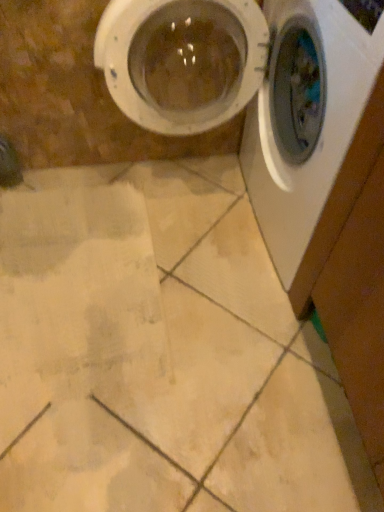
The height and width of the screenshot is (512, 384). What do you see at coordinates (254, 92) in the screenshot? I see `white plastic washing machine at upper right, the 2th washing machine when ordered from right to left` at bounding box center [254, 92].

Where is `white plastic washing machine at upper right, the 2th washing machine when ordered from right to left`? This screenshot has width=384, height=512. white plastic washing machine at upper right, the 2th washing machine when ordered from right to left is located at coordinates (254, 92).

How much space does white plastic washing machine at upper right, which ranks as the first washing machine in left-to-right order, occupy vertically?

white plastic washing machine at upper right, which ranks as the first washing machine in left-to-right order, is 32.14 inches tall.

Describe the element at coordinates (313, 131) in the screenshot. The height and width of the screenshot is (512, 384). I see `white glossy washing machine at right, which ranks as the 2th washing machine in left-to-right order` at that location.

Find the location of a particular element. The height and width of the screenshot is (512, 384). white glossy washing machine at right, which ranks as the 2th washing machine in left-to-right order is located at coordinates (313, 131).

What is the approximate width of white glossy washing machine at right, which is the first washing machine from right to left?

white glossy washing machine at right, which is the first washing machine from right to left, is 17.48 inches in width.

The image size is (384, 512). I want to click on white plastic washing machine at upper right, the 2th washing machine when ordered from right to left, so point(254,92).

Considering the positions of objects white glossy washing machine at right, which is the first washing machine from right to left, and white plastic washing machine at upper right, which ranks as the first washing machine in left-to-right order, in the image provided, who is more to the left, white glossy washing machine at right, which is the first washing machine from right to left, or white plastic washing machine at upper right, which ranks as the first washing machine in left-to-right order,?

white plastic washing machine at upper right, which ranks as the first washing machine in left-to-right order, is more to the left.

Relative to white plastic washing machine at upper right, the 2th washing machine when ordered from right to left, is white glossy washing machine at right, which is the first washing machine from right to left, in front or behind?

white glossy washing machine at right, which is the first washing machine from right to left, is positioned closer to the viewer than white plastic washing machine at upper right, the 2th washing machine when ordered from right to left.

Is point (279, 10) positioned before point (251, 154)?

That is True.

From the image's perspective, is white glossy washing machine at right, which ranks as the 2th washing machine in left-to-right order, on white plastic washing machine at upper right, which ranks as the first washing machine in left-to-right order?

No.

From a real-world perspective, which is physically below, white glossy washing machine at right, which is the first washing machine from right to left, or white plastic washing machine at upper right, which ranks as the first washing machine in left-to-right order?

white glossy washing machine at right, which is the first washing machine from right to left.

Considering the sizes of objects white glossy washing machine at right, which ranks as the 2th washing machine in left-to-right order, and white plastic washing machine at upper right, which ranks as the first washing machine in left-to-right order, in the image provided, who is wider, white glossy washing machine at right, which ranks as the 2th washing machine in left-to-right order, or white plastic washing machine at upper right, which ranks as the first washing machine in left-to-right order,?

Wider between the two is white plastic washing machine at upper right, which ranks as the first washing machine in left-to-right order.

Considering the sizes of objects white glossy washing machine at right, which is the first washing machine from right to left, and white plastic washing machine at upper right, which ranks as the first washing machine in left-to-right order, in the image provided, who is taller, white glossy washing machine at right, which is the first washing machine from right to left, or white plastic washing machine at upper right, which ranks as the first washing machine in left-to-right order,?

white plastic washing machine at upper right, which ranks as the first washing machine in left-to-right order.

Is white glossy washing machine at right, which ranks as the 2th washing machine in left-to-right order, bigger than white plastic washing machine at upper right, which ranks as the first washing machine in left-to-right order?

Yes, white glossy washing machine at right, which ranks as the 2th washing machine in left-to-right order, is bigger than white plastic washing machine at upper right, which ranks as the first washing machine in left-to-right order.

Is white glossy washing machine at right, which ranks as the 2th washing machine in left-to-right order, not within white plastic washing machine at upper right, the 2th washing machine when ordered from right to left?

Yes, white glossy washing machine at right, which ranks as the 2th washing machine in left-to-right order, is located beyond the bounds of white plastic washing machine at upper right, the 2th washing machine when ordered from right to left.

Is white glossy washing machine at right, which ranks as the 2th washing machine in left-to-right order, not near white plastic washing machine at upper right, which ranks as the first washing machine in left-to-right order?

Actually, white glossy washing machine at right, which ranks as the 2th washing machine in left-to-right order, and white plastic washing machine at upper right, which ranks as the first washing machine in left-to-right order, are a little close together.

Is white glossy washing machine at right, which ranks as the 2th washing machine in left-to-right order, positioned with its back to white plastic washing machine at upper right, the 2th washing machine when ordered from right to left?

Absolutely, white glossy washing machine at right, which ranks as the 2th washing machine in left-to-right order, is directed away from white plastic washing machine at upper right, the 2th washing machine when ordered from right to left.

What's the angular difference between white glossy washing machine at right, which is the first washing machine from right to left, and white plastic washing machine at upper right, the 2th washing machine when ordered from right to left,'s facing directions?

0.000184 degrees.

This screenshot has width=384, height=512. What are the coordinates of `washing machine in front of the white plastic washing machine at upper right, the 2th washing machine when ordered from right to left` in the screenshot? It's located at (313, 131).

In the image, is white plastic washing machine at upper right, the 2th washing machine when ordered from right to left, on the left side or the right side of white glossy washing machine at right, which is the first washing machine from right to left?

In the image, white plastic washing machine at upper right, the 2th washing machine when ordered from right to left, appears on the left side of white glossy washing machine at right, which is the first washing machine from right to left.

Does white plastic washing machine at upper right, the 2th washing machine when ordered from right to left, lie behind white glossy washing machine at right, which is the first washing machine from right to left?

Yes, white plastic washing machine at upper right, the 2th washing machine when ordered from right to left, is further from the viewer.

Between point (133, 10) and point (288, 28), which one is positioned in front?

The point (133, 10) is in front.

From the image's perspective, which one is positioned higher, white plastic washing machine at upper right, the 2th washing machine when ordered from right to left, or white glossy washing machine at right, which ranks as the 2th washing machine in left-to-right order?

white plastic washing machine at upper right, the 2th washing machine when ordered from right to left.

From the picture: From a real-world perspective, is white plastic washing machine at upper right, which ranks as the first washing machine in left-to-right order, located higher than white glossy washing machine at right, which is the first washing machine from right to left?

Yes, from a real-world perspective, white plastic washing machine at upper right, which ranks as the first washing machine in left-to-right order, is on top of white glossy washing machine at right, which is the first washing machine from right to left.

Which object is thinner, white plastic washing machine at upper right, which ranks as the first washing machine in left-to-right order, or white glossy washing machine at right, which ranks as the 2th washing machine in left-to-right order?

With smaller width is white glossy washing machine at right, which ranks as the 2th washing machine in left-to-right order.

Between white plastic washing machine at upper right, the 2th washing machine when ordered from right to left, and white glossy washing machine at right, which ranks as the 2th washing machine in left-to-right order, which one has more height?

With more height is white plastic washing machine at upper right, the 2th washing machine when ordered from right to left.

Consider the image. Which of these two, white plastic washing machine at upper right, the 2th washing machine when ordered from right to left, or white glossy washing machine at right, which is the first washing machine from right to left, is bigger?

Bigger between the two is white glossy washing machine at right, which is the first washing machine from right to left.

Is white plastic washing machine at upper right, which ranks as the first washing machine in left-to-right order, not inside white glossy washing machine at right, which ranks as the 2th washing machine in left-to-right order?

That's correct, white plastic washing machine at upper right, which ranks as the first washing machine in left-to-right order, is outside of white glossy washing machine at right, which ranks as the 2th washing machine in left-to-right order.

Are white plastic washing machine at upper right, which ranks as the first washing machine in left-to-right order, and white glossy washing machine at right, which is the first washing machine from right to left, located far from each other?

No, white plastic washing machine at upper right, which ranks as the first washing machine in left-to-right order, is in close proximity to white glossy washing machine at right, which is the first washing machine from right to left.

Does white plastic washing machine at upper right, which ranks as the first washing machine in left-to-right order, turn towards white glossy washing machine at right, which ranks as the 2th washing machine in left-to-right order?

No, white plastic washing machine at upper right, which ranks as the first washing machine in left-to-right order, is not facing towards white glossy washing machine at right, which ranks as the 2th washing machine in left-to-right order.

How many degrees apart are the facing directions of white plastic washing machine at upper right, which ranks as the first washing machine in left-to-right order, and white glossy washing machine at right, which is the first washing machine from right to left?

0.000184 degrees separate the facing orientations of white plastic washing machine at upper right, which ranks as the first washing machine in left-to-right order, and white glossy washing machine at right, which is the first washing machine from right to left.

At what (x,y) coordinates should I click in order to perform the action: click on washing machine below the white plastic washing machine at upper right, the 2th washing machine when ordered from right to left (from the image's perspective). Please return your answer as a coordinate pair (x, y). The height and width of the screenshot is (512, 384). Looking at the image, I should click on (313, 131).

You are a GUI agent. You are given a task and a screenshot of the screen. Output one action in this format:
    pyautogui.click(x=<x>, y=<y>)
    Task: Click on the washing machine lying above the white glossy washing machine at right, which is the first washing machine from right to left (from the image's perspective)
    The height and width of the screenshot is (512, 384).
    Given the screenshot: What is the action you would take?
    pyautogui.click(x=254, y=92)

Find the location of a particular element. This screenshot has height=512, width=384. washing machine below the white plastic washing machine at upper right, which ranks as the first washing machine in left-to-right order (from the image's perspective) is located at coordinates coord(313,131).